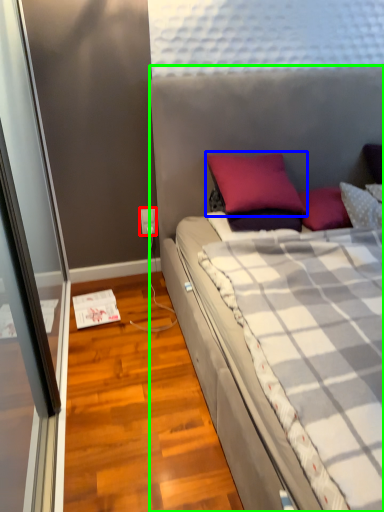
Question: Which object is positioned closest to power outlet (highlighted by a red box)? Select from pillow (highlighted by a blue box) and bed (highlighted by a green box).

Choices:
 (A) pillow
 (B) bed

Answer: (A)